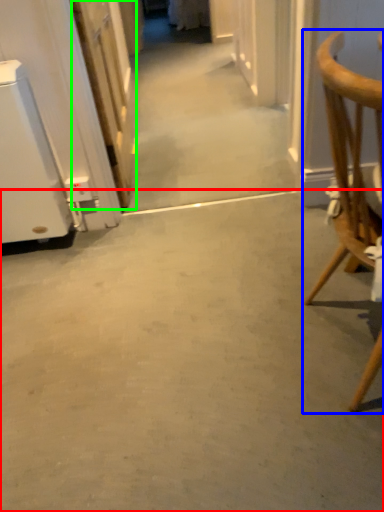
Question: Considering the real-world distances, which object is closest to concrete (highlighted by a red box)? chair (highlighted by a blue box) or door (highlighted by a green box).

Choices:
 (A) chair
 (B) door

Answer: (A)